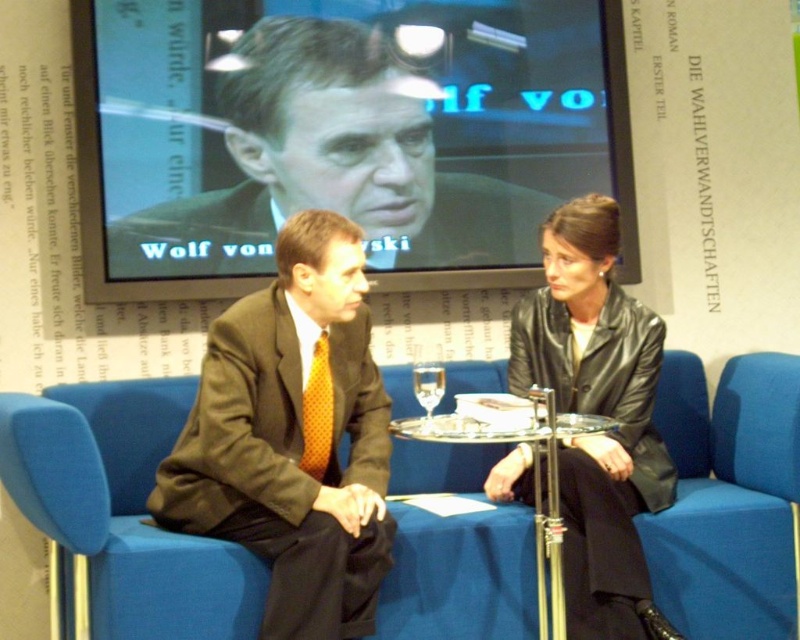
In the scene shown: Does blue fabric chair at center lie behind transparent glass at table center?

Yes, blue fabric chair at center is further from the viewer.

Which is more to the left, blue fabric chair at center or transparent glass at table center?

Positioned to the left is transparent glass at table center.

At what (x,y) coordinates should I click in order to perform the action: click on blue fabric chair at center. Please return your answer as a coordinate pair (x, y). Looking at the image, I should click on (124, 509).

Is blue fabric chair at center thinner than dark brown suit at center?

Correct, blue fabric chair at center's width is less than dark brown suit at center's.

Is blue fabric chair at center bigger than dark brown suit at center?

Incorrect, blue fabric chair at center is not larger than dark brown suit at center.

Find the location of a particular element. This screenshot has width=800, height=640. blue fabric chair at center is located at coordinates (124, 509).

Between black leather jacket at center and transparent glass at table center, which one appears on the left side from the viewer's perspective?

transparent glass at table center is more to the left.

Describe the element at coordinates (598, 413) in the screenshot. I see `black leather jacket at center` at that location.

The image size is (800, 640). Find the location of `black leather jacket at center`. black leather jacket at center is located at coordinates (598, 413).